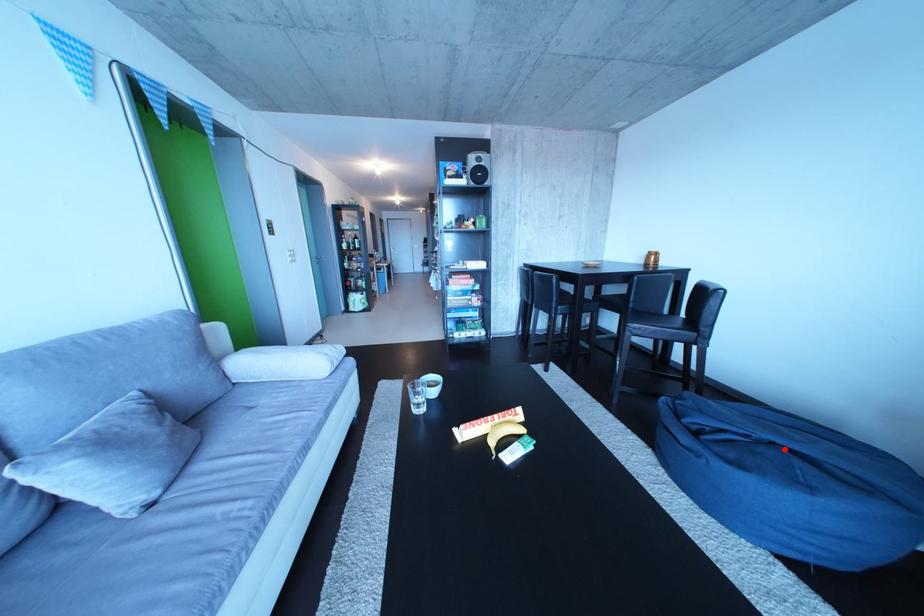
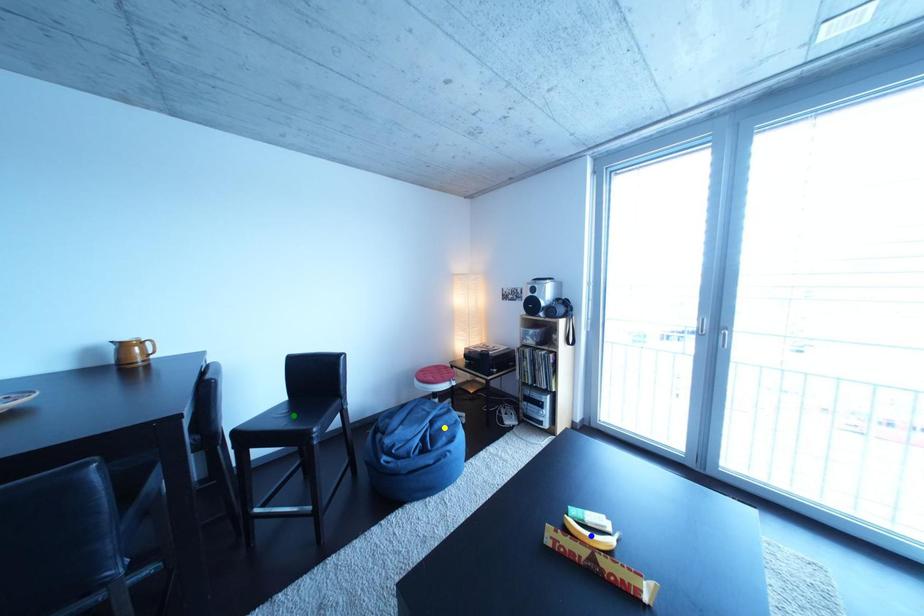
Question: I am providing you with two images of the same scene from different viewpoints. A red point is marked on the first image. You are given multiple points on the second image. Can you choose the point in image 2 that corresponds to the point in image 1?

Choices:
 (A) green point
 (B) blue point
 (C) yellow point

Answer: (C)